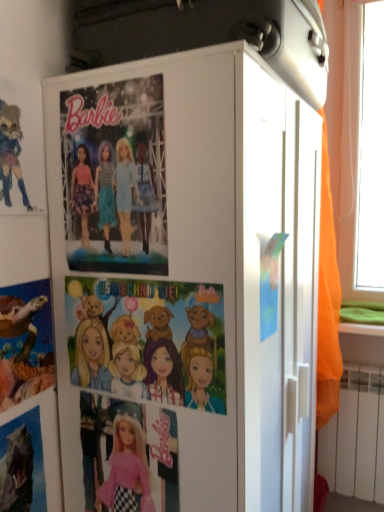
Question: Can white matte cabinet at center be found inside watercolor paper doll at upper left?

Choices:
 (A) no
 (B) yes

Answer: (A)

Question: Is watercolor paper doll at upper left facing towards white matte cabinet at center?

Choices:
 (A) no
 (B) yes

Answer: (A)

Question: Is watercolor paper doll at upper left shorter than white matte cabinet at center?

Choices:
 (A) yes
 (B) no

Answer: (A)

Question: From the image's perspective, does watercolor paper doll at upper left appear lower than white matte cabinet at center?

Choices:
 (A) yes
 (B) no

Answer: (B)

Question: Is watercolor paper doll at upper left wider than white matte cabinet at center?

Choices:
 (A) no
 (B) yes

Answer: (A)

Question: Is watercolor paper doll at upper left further to camera compared to white matte cabinet at center?

Choices:
 (A) yes
 (B) no

Answer: (A)

Question: Can you confirm if white matte cabinet at center is taller than shiny metallic dinosaur at lower left, which appears as the 2th comic book when viewed from the left?

Choices:
 (A) no
 (B) yes

Answer: (B)

Question: Does white matte cabinet at center have a lesser height compared to shiny metallic dinosaur at lower left, which appears as the 2th comic book when viewed from the left?

Choices:
 (A) yes
 (B) no

Answer: (B)

Question: Is white matte cabinet at center surrounding shiny metallic dinosaur at lower left, which is counted as the 2th comic book, starting from the right?

Choices:
 (A) no
 (B) yes

Answer: (A)

Question: Does white matte cabinet at center appear on the left side of shiny metallic dinosaur at lower left, which is counted as the 2th comic book, starting from the right?

Choices:
 (A) no
 (B) yes

Answer: (A)

Question: Considering the relative positions of white matte cabinet at center and shiny metallic dinosaur at lower left, which is counted as the 2th comic book, starting from the right, in the image provided, is white matte cabinet at center to the right of shiny metallic dinosaur at lower left, which is counted as the 2th comic book, starting from the right, from the viewer's perspective?

Choices:
 (A) no
 (B) yes

Answer: (B)

Question: Is white matte cabinet at center aimed at shiny metallic dinosaur at lower left, which is counted as the 2th comic book, starting from the right?

Choices:
 (A) yes
 (B) no

Answer: (B)

Question: Is shiny metallic dinosaur at lower left, which is counted as the 2th comic book, starting from the right, with matte paper poster at center?

Choices:
 (A) no
 (B) yes

Answer: (A)